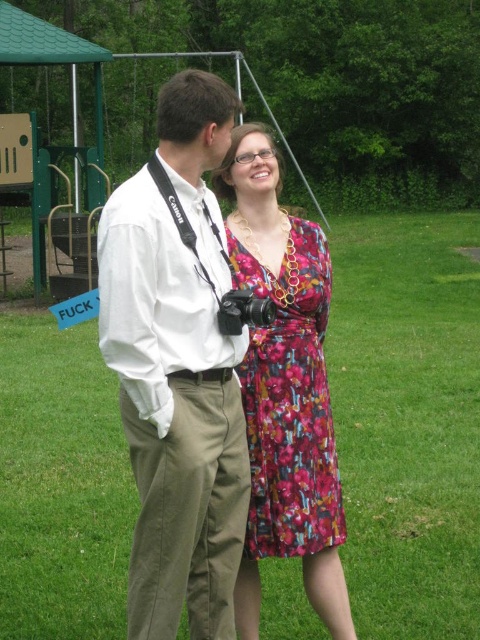
Question: Is green grass at center to the right of white cotton shirt at center from the viewer's perspective?

Choices:
 (A) yes
 (B) no

Answer: (B)

Question: Is green grass at center to the left of floral silk dress at center from the viewer's perspective?

Choices:
 (A) no
 (B) yes

Answer: (B)

Question: Does white cotton shirt at center appear on the left side of floral silk dress at center?

Choices:
 (A) no
 (B) yes

Answer: (B)

Question: Which of these objects is positioned farthest from the floral silk dress at center?

Choices:
 (A) white cotton shirt at center
 (B) green grass at center

Answer: (B)

Question: Considering the real-world distances, which object is closest to the white cotton shirt at center?

Choices:
 (A) green grass at center
 (B) floral silk dress at center

Answer: (B)

Question: Among these points, which one is nearest to the camera?

Choices:
 (A) (361, 556)
 (B) (195, 172)

Answer: (B)